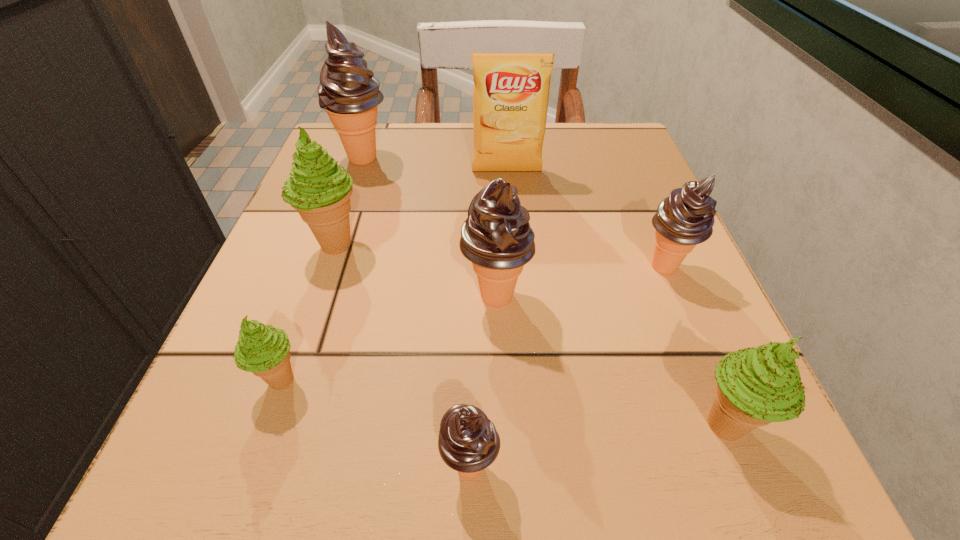
This screenshot has height=540, width=960. Identify the location of the leftmost chocolate icecream. (348, 92).

Image resolution: width=960 pixels, height=540 pixels. I want to click on the farthest icecream, so click(348, 92).

Find the location of a particular element. This screenshot has width=960, height=540. crisp (potato chip) is located at coordinates (511, 90).

At what (x,y) coordinates should I click in order to perform the action: click on the farthest green icecream. Please return your answer as a coordinate pair (x, y). The image size is (960, 540). Looking at the image, I should click on (318, 188).

The width and height of the screenshot is (960, 540). Find the location of `the third smallest chocolate icecream`. the third smallest chocolate icecream is located at coordinates (496, 237).

Identify the location of the second smallest chocolate icecream. (684, 219).

Identify the location of the second biggest green icecream. [755, 386].

At what (x,y) coordinates should I click in order to perform the action: click on the smallest green icecream. Please return your answer as a coordinate pair (x, y). This screenshot has width=960, height=540. Looking at the image, I should click on (261, 349).

This screenshot has width=960, height=540. I want to click on the nearest chocolate icecream, so click(x=468, y=442).

What are the coordinates of `vacant space located 0.090m on the front of the leftmost chocolate icecream` in the screenshot? It's located at (348, 202).